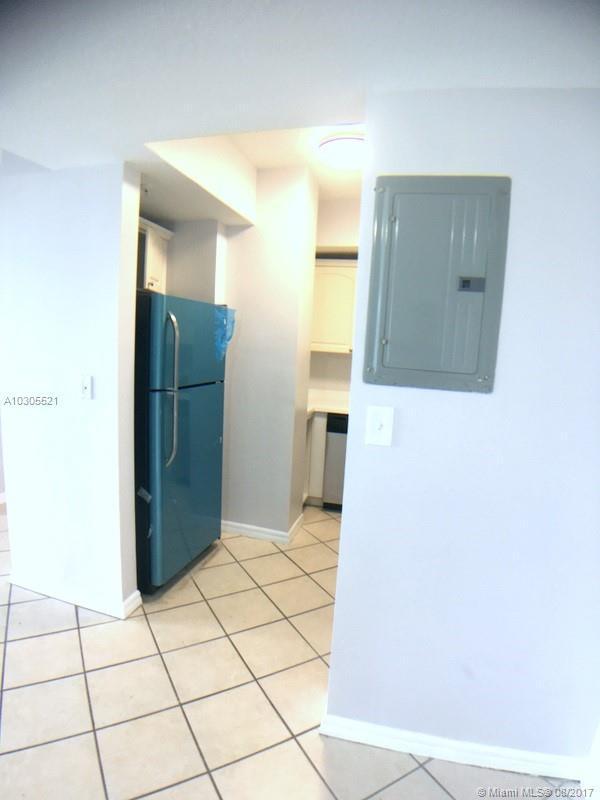
Identify the location of cabinets. This screenshot has width=600, height=800. (334, 320), (158, 258).